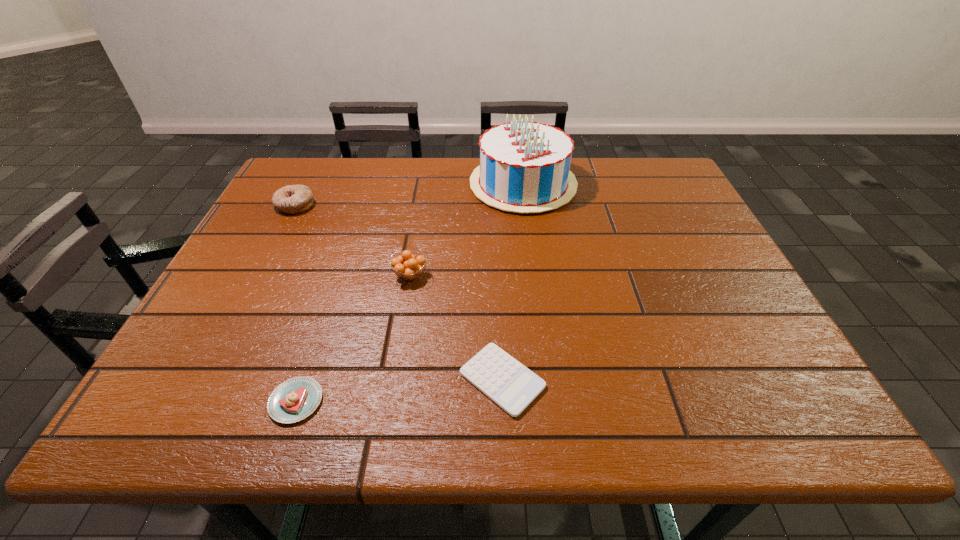
Where is `free space located 0.380m on the front of the doughnut`? This screenshot has width=960, height=540. free space located 0.380m on the front of the doughnut is located at coordinates (231, 328).

Locate an element on the screen. vacant space located on the back of the fourth object from right to left is located at coordinates (321, 328).

The height and width of the screenshot is (540, 960). In order to click on vacant position located 0.310m on the back of the shortest object in this screenshot , I will do `click(496, 244)`.

This screenshot has width=960, height=540. What are the coordinates of `birthday cake at the far edge` in the screenshot? It's located at (524, 167).

Find the location of a particular element. This screenshot has width=960, height=540. doughnut that is at the far edge is located at coordinates (293, 199).

This screenshot has width=960, height=540. Find the location of `pastry located in the near edge section of the desktop`. pastry located in the near edge section of the desktop is located at coordinates (295, 399).

Where is `calculator located in the near edge section of the desktop`? The height and width of the screenshot is (540, 960). calculator located in the near edge section of the desktop is located at coordinates (512, 386).

The image size is (960, 540). I want to click on object present at the left edge, so click(x=293, y=199).

The width and height of the screenshot is (960, 540). In order to click on object at the far left corner in this screenshot , I will do `click(293, 199)`.

Identify the location of vacant space at the far edge. (333, 192).